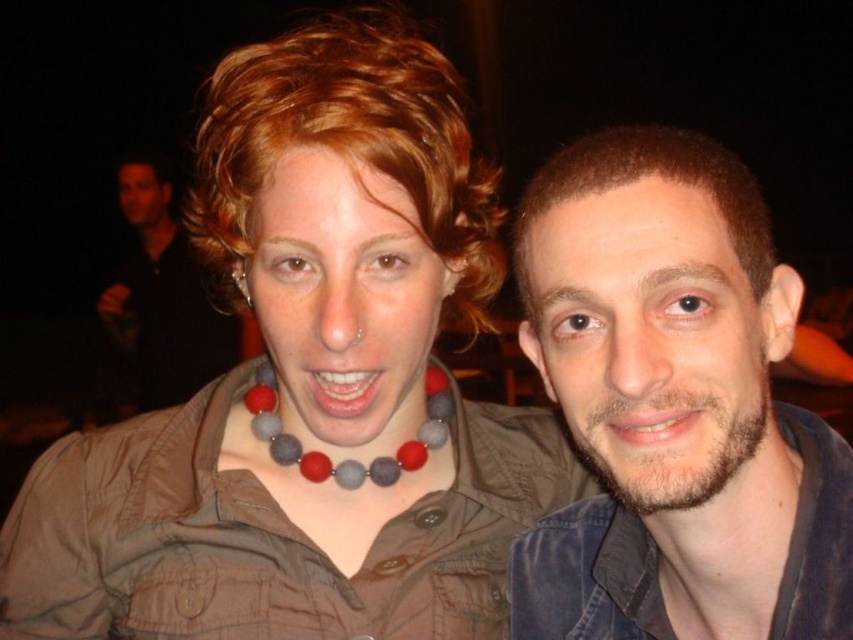
Question: Which point is farther from the camera taking this photo?

Choices:
 (A) (618, 132)
 (B) (641, 440)
 (C) (144, 328)
 (D) (283, 465)

Answer: (C)

Question: Is multicolored beaded necklace at center bigger than matte black face at upper left?

Choices:
 (A) no
 (B) yes

Answer: (B)

Question: Which of the following is the closest to the observer?

Choices:
 (A) (143, 212)
 (B) (631, 420)
 (C) (418, 282)

Answer: (B)

Question: Does bright red lips at center appear on the right side of smooth skin mouth at center?

Choices:
 (A) yes
 (B) no

Answer: (B)

Question: Which point is closer to the camera taking this photo?

Choices:
 (A) (714, 257)
 (B) (305, 278)

Answer: (A)

Question: Can you confirm if denim jacket at right is positioned to the left of brown matte face at right?

Choices:
 (A) yes
 (B) no

Answer: (B)